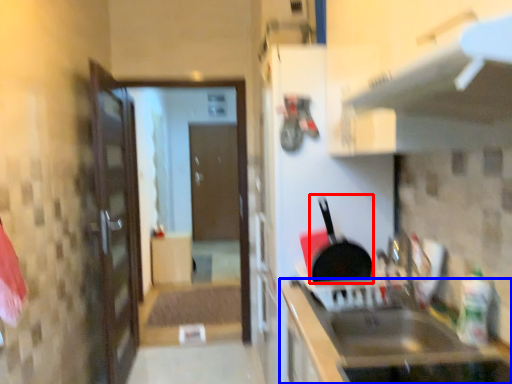
Question: Which object appears closest to the camera in this image, frying pan (highlighted by a red box) or cabinetry (highlighted by a blue box)?

Choices:
 (A) frying pan
 (B) cabinetry

Answer: (B)